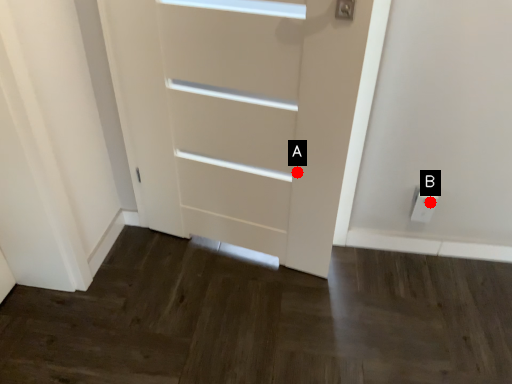
Question: Two points are circled on the image, labeled by A and B beside each circle. Among these points, which one is farthest from the camera?

Choices:
 (A) A is further
 (B) B is further

Answer: (B)